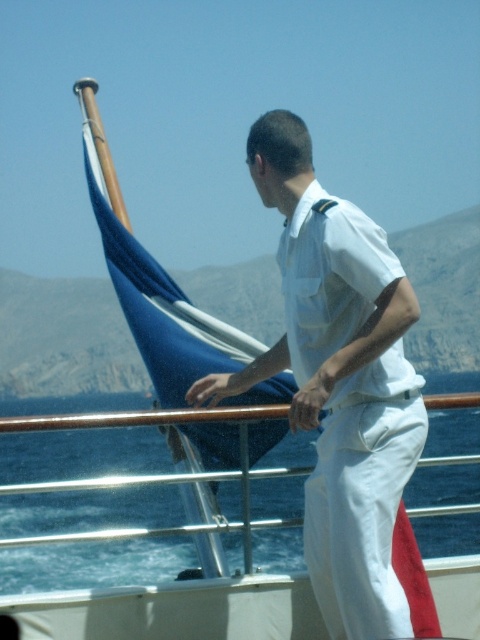
Question: Which of these objects is positioned closest to the blue water at lower center?

Choices:
 (A) white matte hand at center
 (B) matte white hand at center

Answer: (A)

Question: Does blue water at lower center come in front of matte white hand at center?

Choices:
 (A) yes
 (B) no

Answer: (B)

Question: Estimate the real-world distances between objects in this image. Which object is farther from the blue water at lower center?

Choices:
 (A) matte white hand at center
 (B) white cotton shirt at center

Answer: (B)

Question: Is blue water at lower center positioned before white matte hand at center?

Choices:
 (A) yes
 (B) no

Answer: (A)

Question: From the image, what is the correct spatial relationship of white cotton shirt at center in relation to blue water at lower center?

Choices:
 (A) right
 (B) left

Answer: (B)

Question: Which point is closer to the camera?

Choices:
 (A) (320, 390)
 (B) (348, 506)

Answer: (B)